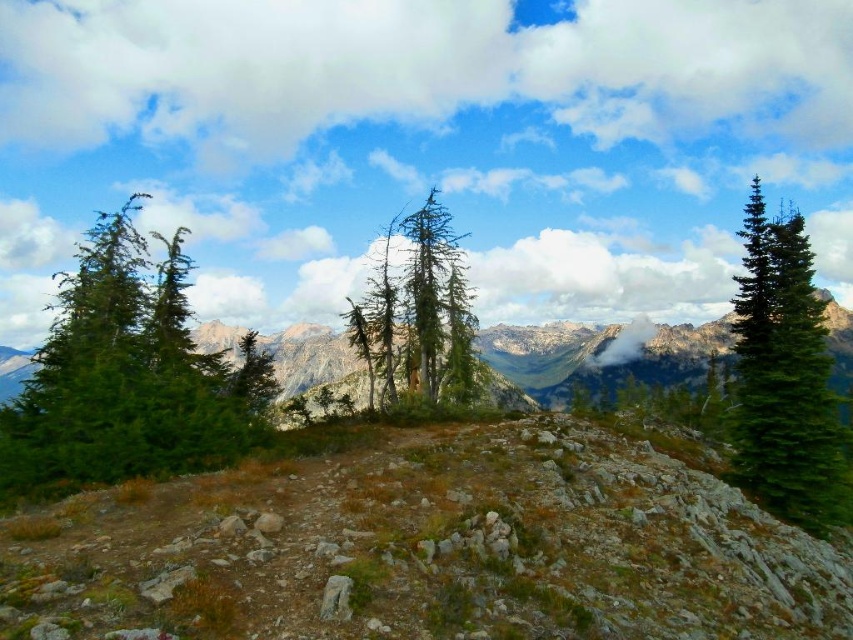
Question: Which point is closer to the camera?

Choices:
 (A) green matte tree at left
 (B) green matte tree at center-left
 (C) green textured mountain at center

Answer: (A)

Question: Observing the image, what is the correct spatial positioning of green matte tree at left in reference to green textured tree at center?

Choices:
 (A) right
 (B) left

Answer: (B)

Question: Can you confirm if green matte tree at right is bigger than green textured mountain at center?

Choices:
 (A) no
 (B) yes

Answer: (A)

Question: Which object is farther from the camera taking this photo?

Choices:
 (A) green matte tree at center-left
 (B) green textured mountain at center
 (C) brown rocky hillside at center
 (D) green matte tree at right

Answer: (A)

Question: Which is nearer to the brown rocky hillside at center?

Choices:
 (A) green textured mountain at center
 (B) green matte tree at left

Answer: (B)

Question: Can you confirm if green textured tree at center is thinner than green matte tree at center-left?

Choices:
 (A) no
 (B) yes

Answer: (B)